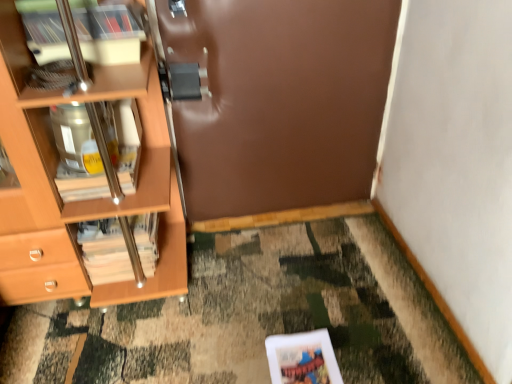
I want to click on unoccupied region to the right of brown matte door at center, so click(x=352, y=238).